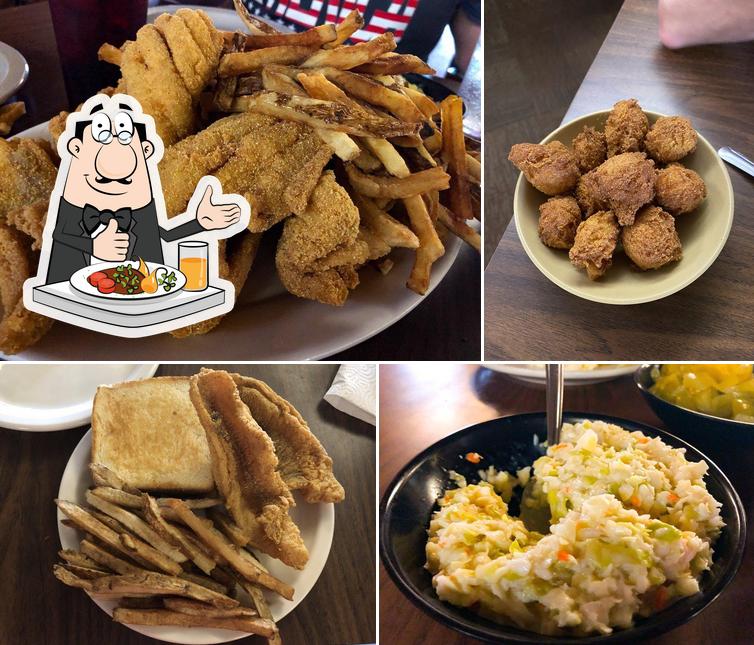
This screenshot has height=645, width=754. Identify the location of place to set things on table. (17, 542), (445, 404), (528, 317), (38, 48).